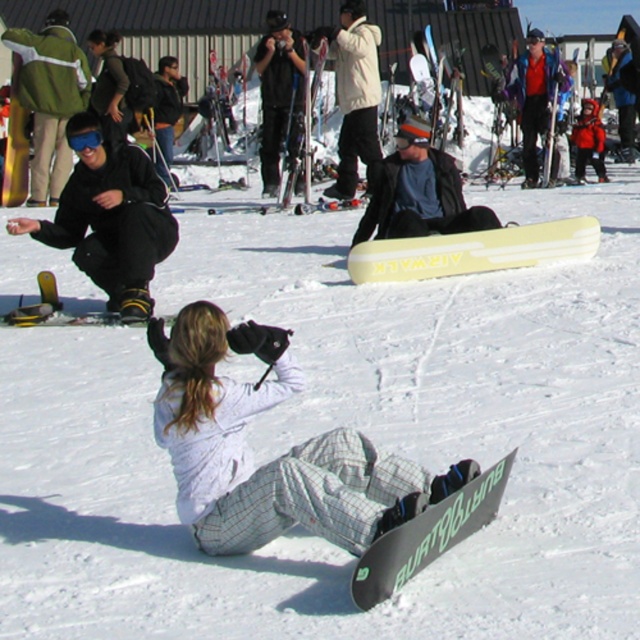
Question: Is white matte snowboard at center thinner than black matte goggles at upper left?

Choices:
 (A) yes
 (B) no

Answer: (B)

Question: Which point is farther to the camera?

Choices:
 (A) (467, 534)
 (B) (81, 164)
 (C) (186, 465)

Answer: (B)

Question: Which of these objects is positioned farthest from the yellow matte snowboard at center?

Choices:
 (A) black matte goggles at upper left
 (B) matte black snowboard at left

Answer: (A)

Question: Can you confirm if black matte snowboard at lower center is bigger than black matte goggles at upper left?

Choices:
 (A) no
 (B) yes

Answer: (B)

Question: Among these objects, which one is farthest from the camera?

Choices:
 (A) matte black snowboard at left
 (B) black matte goggles at upper left
 (C) yellow matte snowboard at center
 (D) black matte snowboard at lower center

Answer: (C)

Question: Does yellow matte snowboard at center have a larger size compared to black matte goggles at upper left?

Choices:
 (A) yes
 (B) no

Answer: (A)